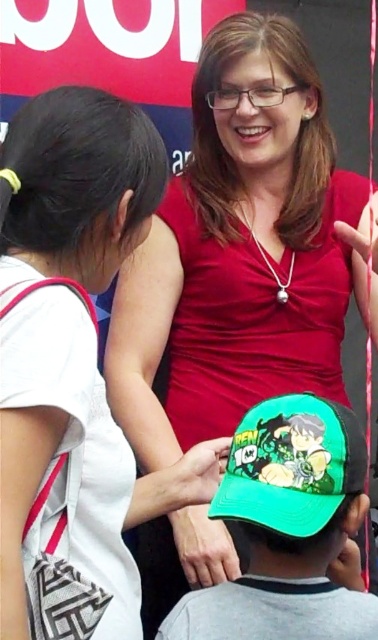
You are a photographer trying to capture a candid shot of the child without them noticing. You have a camera that can focus on objects within 1 meter. The matte green cap at center and the green fabric cap at lower center are both in your view. Which cap should you focus on to ensure the child remains in frame while maintaining focus on the closer cap?

The matte green cap at center is wider than the green fabric cap at lower center, so focusing on the matte green cap at center would keep the child in frame while maintaining focus on the closer cap.

You are a photographer trying to capture the perfect shot of the matte green cap at center. The camera is set at a fixed position. The cap is at coordinates point 0.394, 0.635. If the camera can only focus on objects within a 0.1 unit radius around its current position, is the cap within the focus range?

The matte green cap at center is positioned at point (240, 252). Since the camera can only focus on objects within a 0.1 unit radius around its current position, the cap is within the focus range if the camera is positioned within 0.1 units of those coordinates. However, without knowing the camera position, we cannot confirm definitively.

You are a photographer trying to capture a clear shot of both the matte green cap at center and the green fabric cap at lower center. Since the two caps are positioned in a way that one might block the view of the other, which cap should you focus on first to ensure the lower one is visible?

The matte green cap at center is above green fabric cap at lower center, so you should focus on the green fabric cap at lower center first to ensure it isn